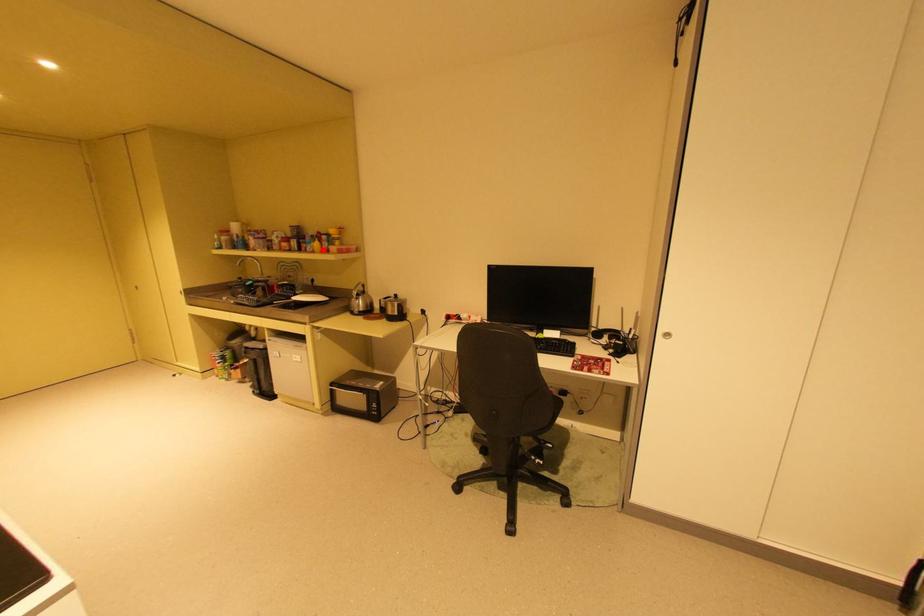
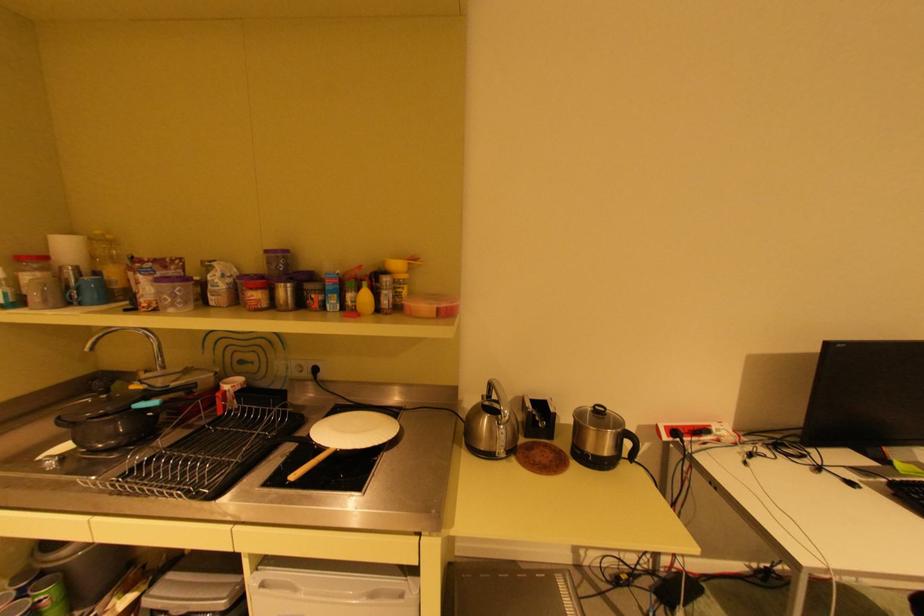
The point at the highlighted location is marked in the first image. Where is the corresponding point in the second image?

(367, 309)